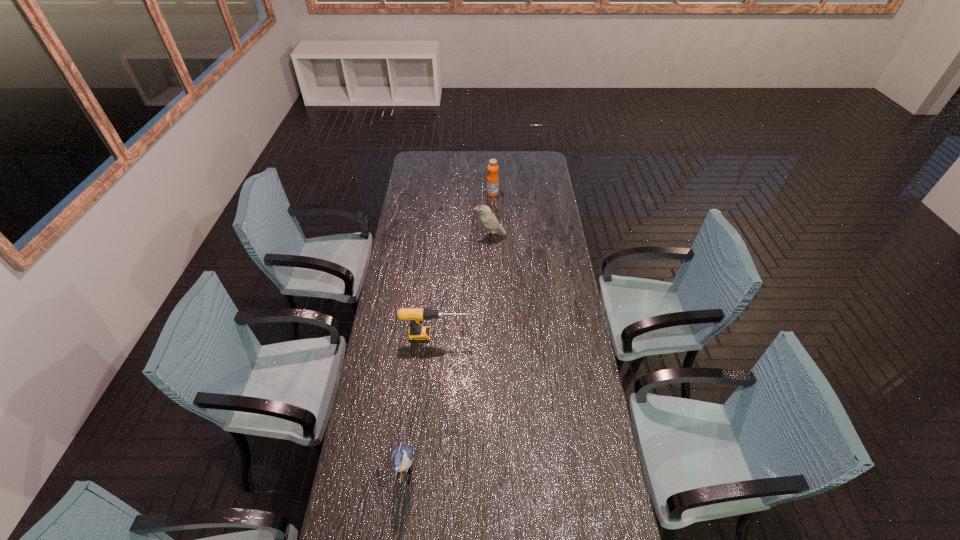
At what (x,y) coordinates should I click in order to perform the action: click on the farthest object. Please return your answer as a coordinate pair (x, y). Image resolution: width=960 pixels, height=540 pixels. Looking at the image, I should click on [492, 178].

The image size is (960, 540). Find the location of `the third nearest object`. the third nearest object is located at coordinates (x=487, y=218).

Identify the location of the right bird. (487, 218).

Where is `the nearer bird`? The height and width of the screenshot is (540, 960). the nearer bird is located at coordinates (402, 456).

This screenshot has width=960, height=540. I want to click on the nearest object, so click(x=402, y=456).

You are a GUI agent. You are given a task and a screenshot of the screen. Output one action in this format:
    pyautogui.click(x=<x>, y=<y>)
    Task: Click on the drill
    The width and height of the screenshot is (960, 540).
    Given the screenshot: What is the action you would take?
    pyautogui.click(x=416, y=315)

At what (x,y) coordinates should I click in order to perform the action: click on free space located on the front of the fruit juice. Please return your answer as a coordinate pair (x, y). Image resolution: width=960 pixels, height=540 pixels. Looking at the image, I should click on (492, 202).

I want to click on free spot located at the face of the right bird, so click(431, 236).

Locate an element on the screen. The image size is (960, 540). vacant area situated at the face of the right bird is located at coordinates (444, 236).

Find the location of `vacant space situated at the face of the right bird`. vacant space situated at the face of the right bird is located at coordinates (398, 236).